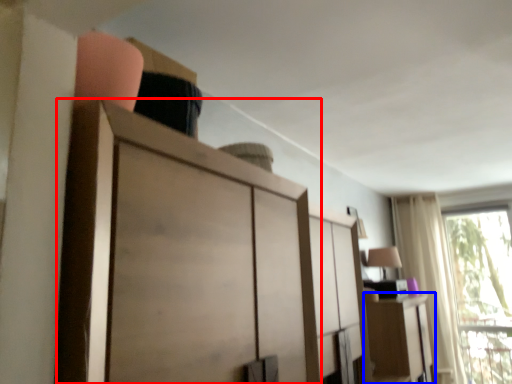
Question: Which of the following is the farthest to the observer, cupboard (highlighted by a red box) or cabinetry (highlighted by a blue box)?

Choices:
 (A) cupboard
 (B) cabinetry

Answer: (B)